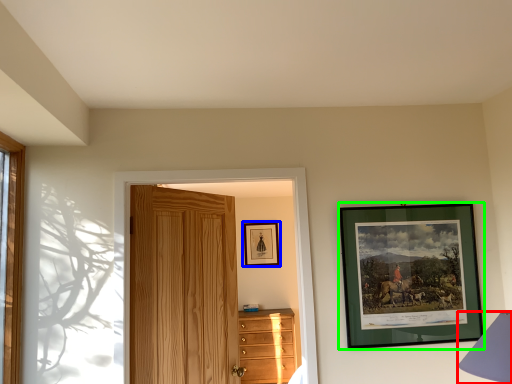
Question: Based on their relative distances, which object is nearer to table lamp (highlighted by a red box)? Choose from picture frame (highlighted by a blue box) and picture frame (highlighted by a green box).

Choices:
 (A) picture frame
 (B) picture frame

Answer: (B)